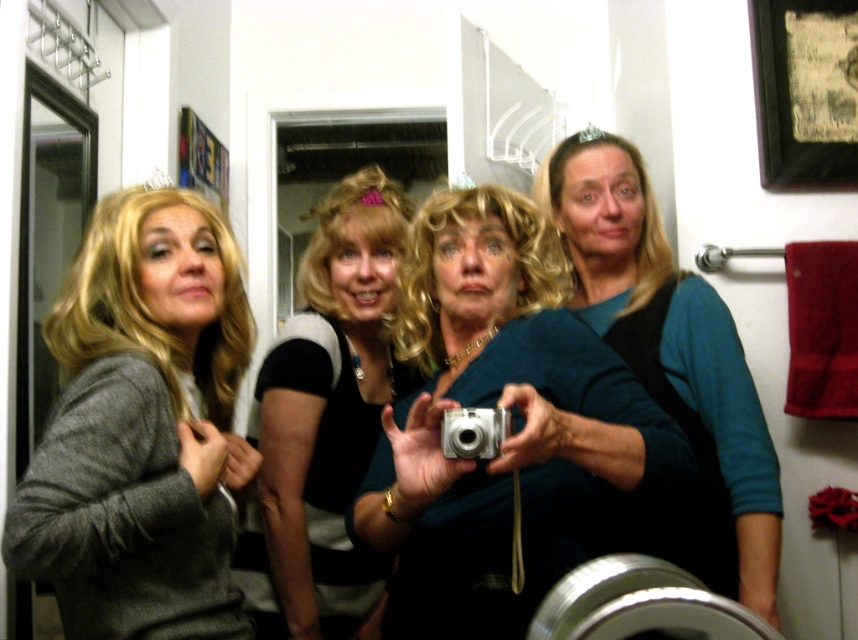
Question: From the image, what is the correct spatial relationship of teal fabric top at center in relation to silver metallic camera at center?

Choices:
 (A) right
 (B) left

Answer: (A)

Question: Which object appears closest to the camera in this image?

Choices:
 (A) black and white striped shirt at center
 (B) teal fabric top at center
 (C) metallic silver camera at center

Answer: (C)

Question: Can you confirm if metallic silver camera at center is positioned to the left of black and white striped shirt at center?

Choices:
 (A) yes
 (B) no

Answer: (B)

Question: Does gray woolen sweater at left have a larger size compared to teal fabric top at center?

Choices:
 (A) yes
 (B) no

Answer: (B)

Question: Among these points, which one is farthest from the camera?

Choices:
 (A) (457, 426)
 (B) (470, 340)
 (C) (134, 541)
 (D) (321, 579)

Answer: (D)

Question: Which point is farther from the camera taking this photo?

Choices:
 (A) (766, 461)
 (B) (464, 440)
 (C) (317, 292)
 (D) (433, 326)

Answer: (C)